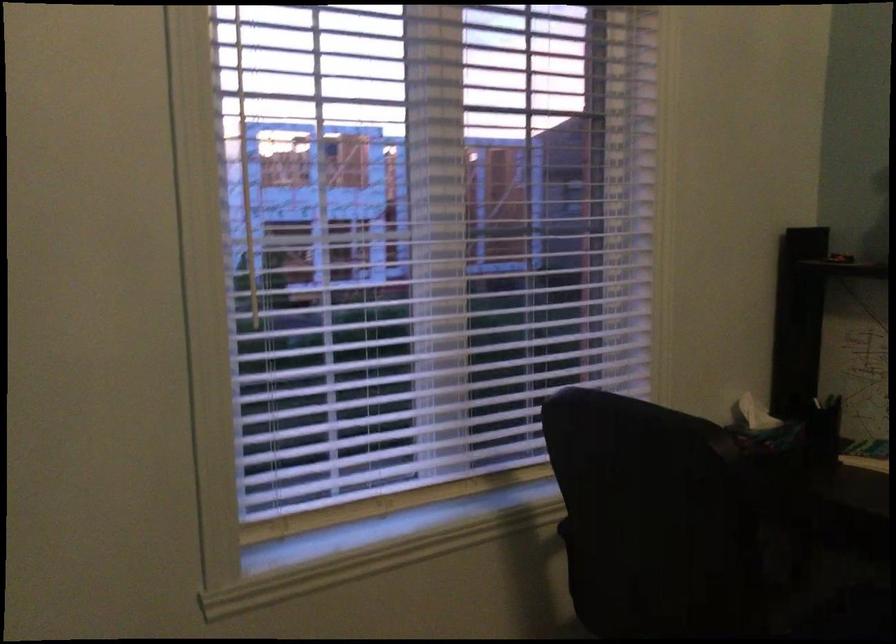
Image resolution: width=896 pixels, height=644 pixels. I want to click on blind tilting rod, so click(250, 247).